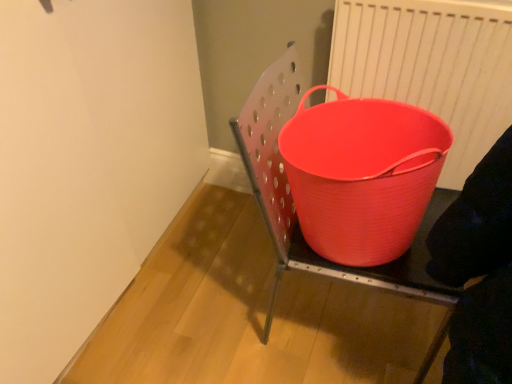
Question: Does matte plastic bucket at center have a greater width compared to matte plastic bucket at right?

Choices:
 (A) no
 (B) yes

Answer: (A)

Question: Considering the relative sizes of matte plastic bucket at center and matte plastic bucket at right in the image provided, is matte plastic bucket at center smaller than matte plastic bucket at right?

Choices:
 (A) yes
 (B) no

Answer: (B)

Question: Is matte plastic bucket at center closer to camera compared to matte plastic bucket at right?

Choices:
 (A) yes
 (B) no

Answer: (A)

Question: Is matte plastic bucket at center not within matte plastic bucket at right?

Choices:
 (A) no
 (B) yes

Answer: (B)

Question: Does matte plastic bucket at center have a greater height compared to matte plastic bucket at right?

Choices:
 (A) yes
 (B) no

Answer: (A)

Question: From a real-world perspective, relative to matte plastic bucket at center, is matte plastic bucket at right vertically above or below?

Choices:
 (A) below
 (B) above

Answer: (A)

Question: Is point (435, 324) closer or farther from the camera than point (432, 342)?

Choices:
 (A) closer
 (B) farther

Answer: (B)

Question: Do you think matte plastic bucket at right is within matte plastic bucket at center, or outside of it?

Choices:
 (A) outside
 (B) inside

Answer: (A)

Question: In the image, is matte plastic bucket at right positioned in front of or behind matte plastic bucket at center?

Choices:
 (A) front
 (B) behind

Answer: (B)

Question: From a real-world perspective, relative to matte plastic bucket at right, is matte plastic bucket at center vertically above or below?

Choices:
 (A) above
 (B) below

Answer: (A)

Question: Is point (388, 231) positioned closer to the camera than point (314, 372)?

Choices:
 (A) closer
 (B) farther

Answer: (A)

Question: Relative to matte plastic bucket at right, is matte plastic bucket at center in front or behind?

Choices:
 (A) behind
 (B) front

Answer: (B)

Question: Considering the relative positions of matte plastic bucket at center and matte plastic bucket at right in the image provided, is matte plastic bucket at center to the left or to the right of matte plastic bucket at right?

Choices:
 (A) left
 (B) right

Answer: (B)

Question: Considering the positions of point (306, 223) and point (506, 82), is point (306, 223) closer or farther from the camera than point (506, 82)?

Choices:
 (A) farther
 (B) closer

Answer: (B)

Question: Would you say matte plastic bucket at center is inside or outside white plastic radiator at upper right?

Choices:
 (A) outside
 (B) inside

Answer: (A)